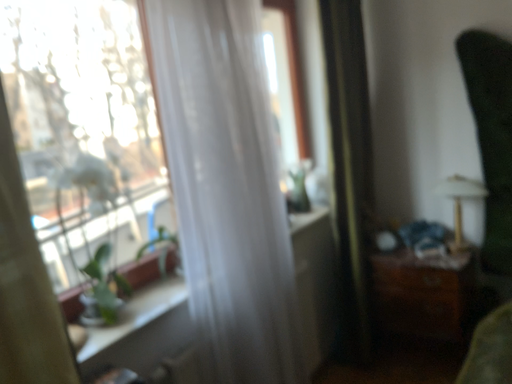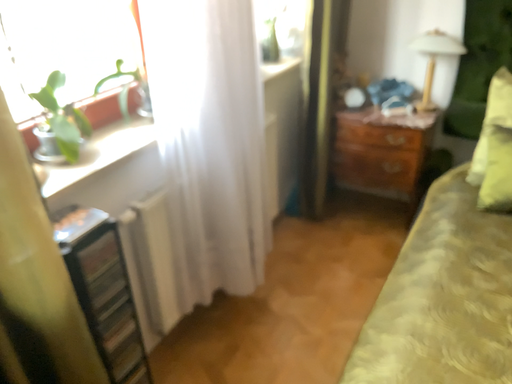
Question: How did the camera likely rotate when shooting the video?

Choices:
 (A) rotated left
 (B) rotated right

Answer: (B)